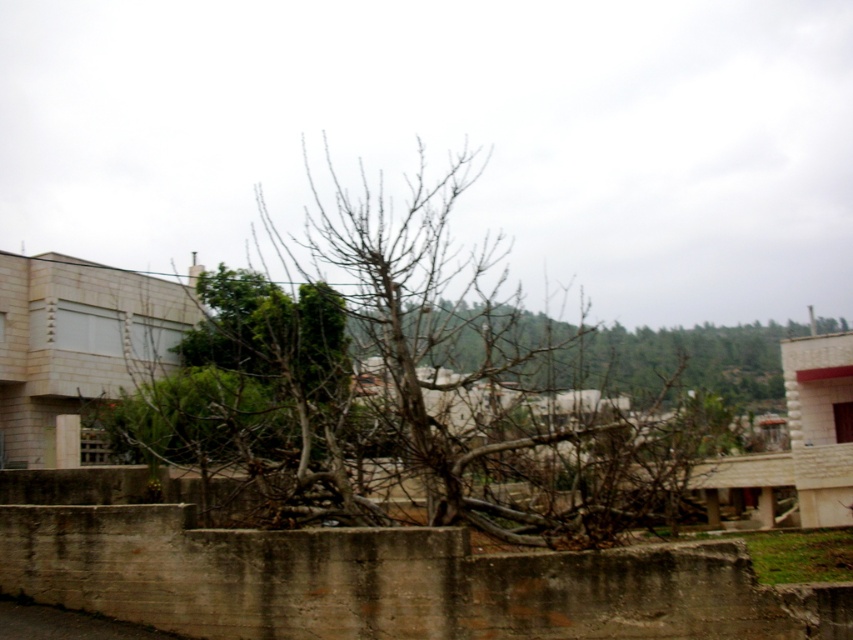
Question: Which point is closer to the camera?

Choices:
 (A) bare branches at center
 (B) brown/dry wood tree at center

Answer: (B)

Question: Which of the following is the closest to the observer?

Choices:
 (A) bare branches at center
 (B) brown/dry wood tree at center

Answer: (B)

Question: Can you confirm if brown/dry wood tree at center is positioned above bare branches at center?

Choices:
 (A) yes
 (B) no

Answer: (A)

Question: Is brown/dry wood tree at center thinner than bare branches at center?

Choices:
 (A) no
 (B) yes

Answer: (B)

Question: Where is brown/dry wood tree at center located in relation to bare branches at center in the image?

Choices:
 (A) right
 (B) left

Answer: (B)